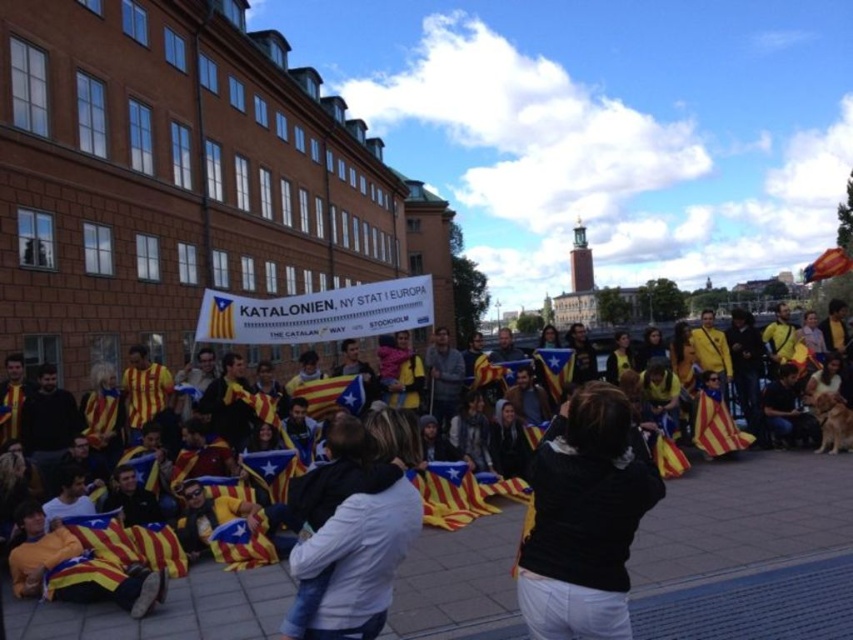
Is yellow fabric flag at center wider than black fabric at center?

Correct, the width of yellow fabric flag at center exceeds that of black fabric at center.

Which is behind, point (467, 554) or point (587, 513)?

The point (467, 554) is more distant.

Where is `yellow fabric flag at center`? The width and height of the screenshot is (853, 640). yellow fabric flag at center is located at coordinates (747, 548).

Identify the location of yellow fabric flag at center. (747, 548).

Does yellow fabric flag at center have a larger size compared to white cotton shirt at center?

Correct, yellow fabric flag at center is larger in size than white cotton shirt at center.

Is yellow fabric flag at center positioned in front of white cotton shirt at center?

No.

Between point (231, 612) and point (351, 616), which one is positioned in front?

Positioned in front is point (351, 616).

The width and height of the screenshot is (853, 640). Find the location of `yellow fabric flag at center`. yellow fabric flag at center is located at coordinates (747, 548).

Between point (573, 403) and point (318, 516), which one is positioned in front?

Positioned in front is point (318, 516).

What do you see at coordinates (584, 518) in the screenshot? I see `black fabric at center` at bounding box center [584, 518].

Where is `black fabric at center`? The height and width of the screenshot is (640, 853). black fabric at center is located at coordinates (584, 518).